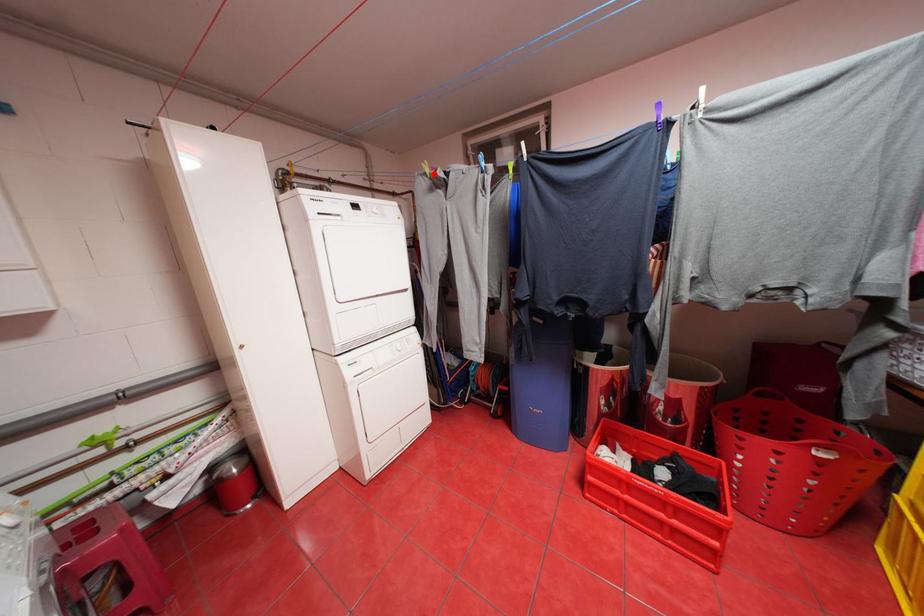
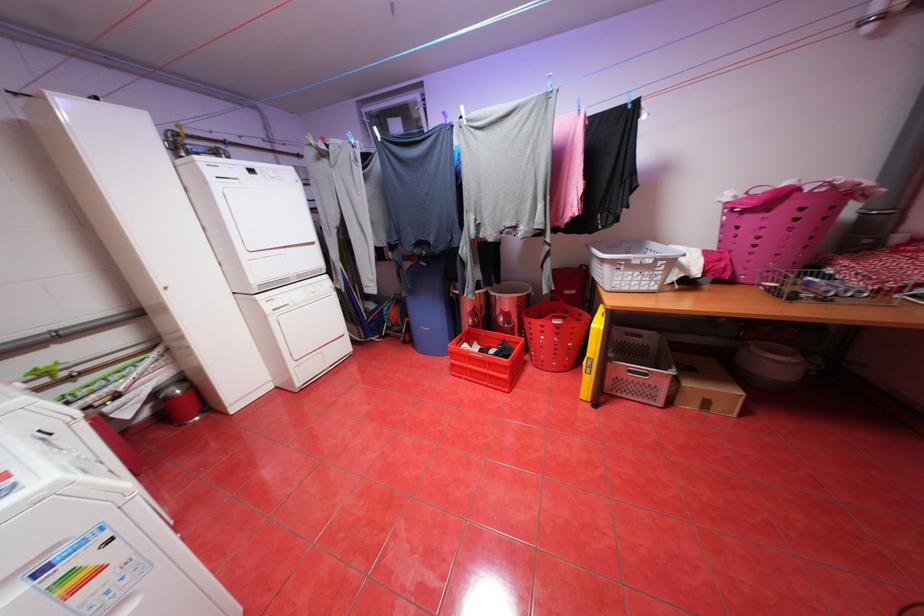
The point at the highlighted location is marked in the first image. Where is the corresponding point in the second image?

(320, 145)